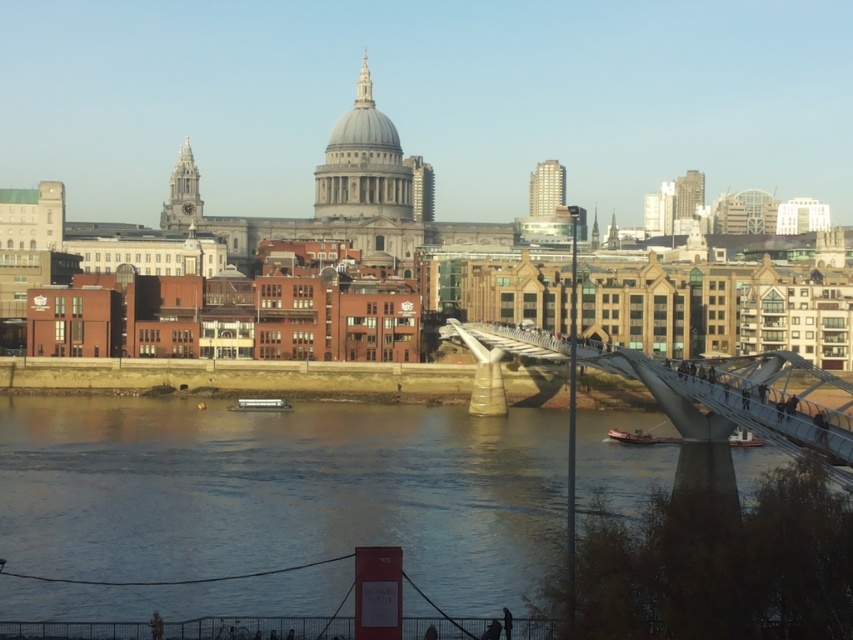
Is clear water at lower center smaller than metallic gray bridge at center?

Actually, clear water at lower center might be larger than metallic gray bridge at center.

Between point (506, 476) and point (750, 417), which one is positioned in front?

Point (750, 417) is in front.

Identify the location of clear water at lower center. (282, 492).